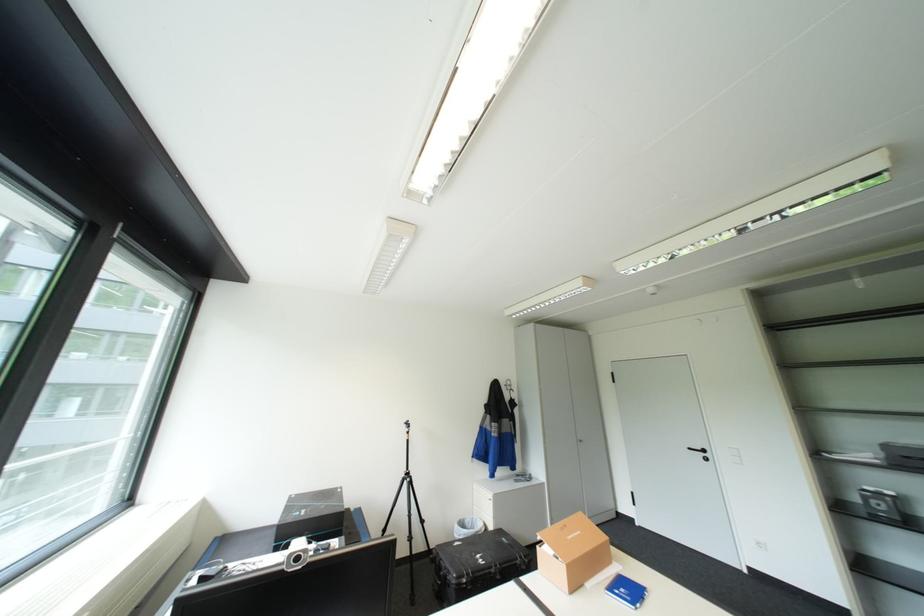
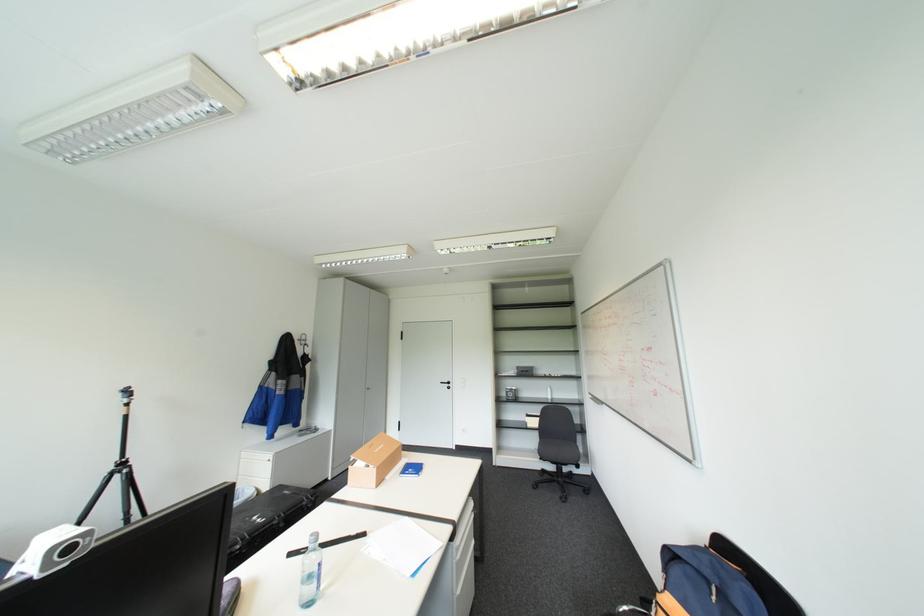
Locate, in the second image, the point that corresponds to (x=414, y=480) in the first image.

(126, 475)